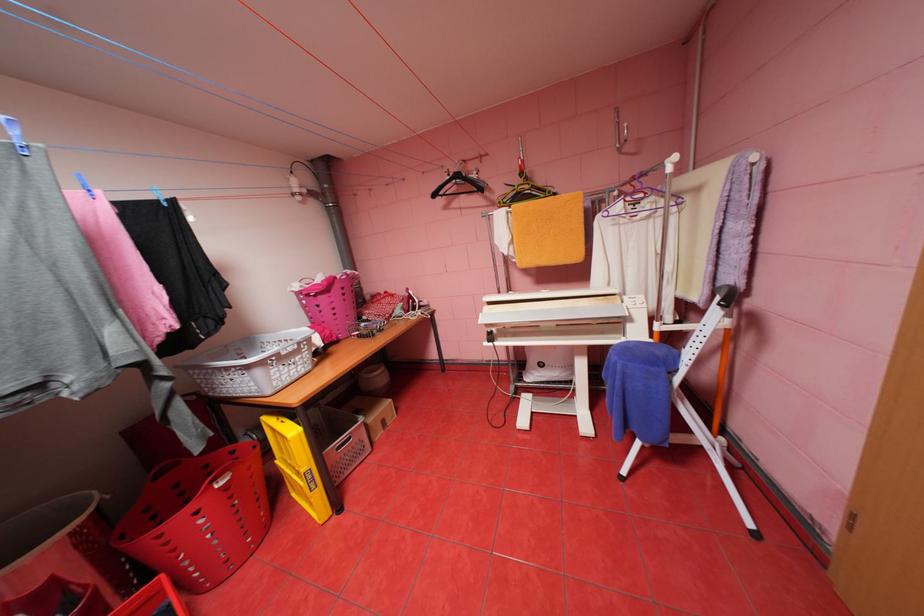
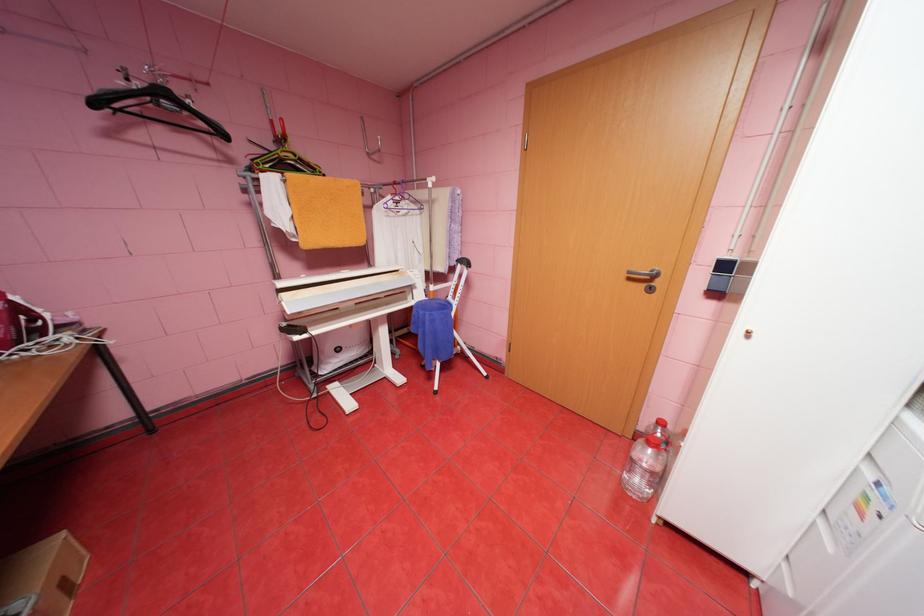
Locate, in the second image, the point that corresponds to pixel 627 148 in the first image.

(377, 154)